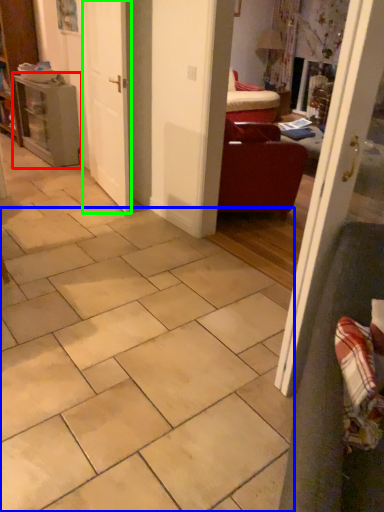
Question: Which is nearer to the table (highlighted by a red box)? ceramic tile (highlighted by a blue box) or door (highlighted by a green box).

Choices:
 (A) ceramic tile
 (B) door

Answer: (B)